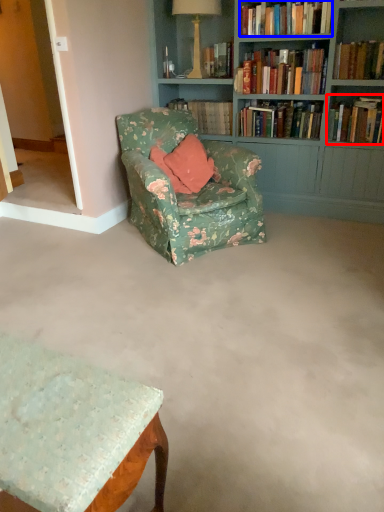
Question: Which point is closer to the camera, book (highlighted by a red box) or book (highlighted by a blue box)?

Choices:
 (A) book
 (B) book

Answer: (B)